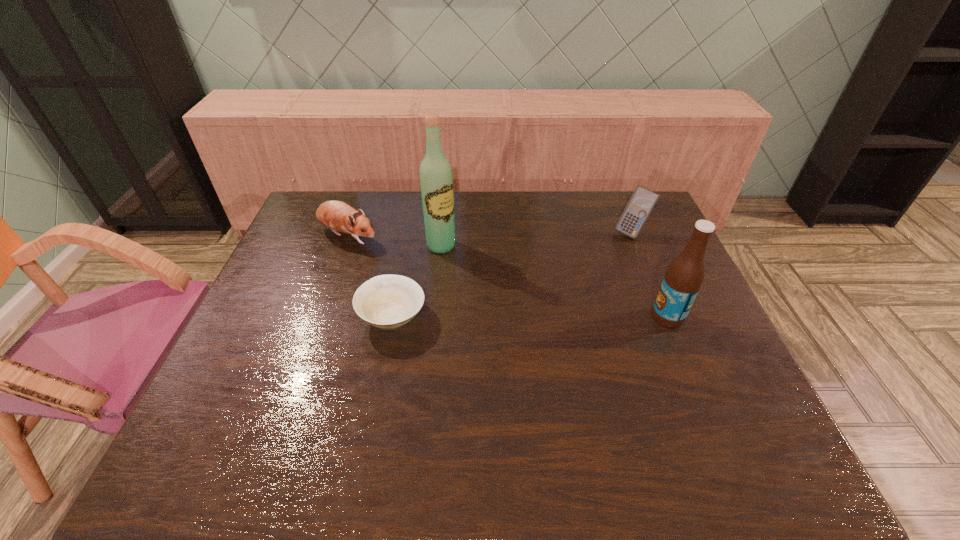
The height and width of the screenshot is (540, 960). I want to click on free space located 0.300m on the front-facing side of the third tallest object, so click(x=580, y=293).

At what (x,y) coordinates should I click in order to perform the action: click on vacant space located 0.260m on the front-facing side of the third tallest object. Please return your answer as a coordinate pair (x, y). This screenshot has width=960, height=540. Looking at the image, I should click on (586, 285).

Locate an element on the screen. Image resolution: width=960 pixels, height=540 pixels. vacant space located on the front-facing side of the third tallest object is located at coordinates (565, 310).

The width and height of the screenshot is (960, 540). I want to click on vacant region located 0.070m at the face of the fourth tallest object, so [x=387, y=253].

At what (x,y) coordinates should I click in order to perform the action: click on free region located 0.080m at the face of the fourth tallest object. Please return your answer as a coordinate pair (x, y). The width and height of the screenshot is (960, 540). Looking at the image, I should click on (390, 255).

In order to click on vacant area situated at the face of the fourth tallest object in this screenshot , I will do `click(421, 272)`.

Identify the location of calculator positioned at the far edge. This screenshot has width=960, height=540. (642, 202).

At what (x,y) coordinates should I click in order to perform the action: click on hamster located at the far edge. Please return your answer as a coordinate pair (x, y). This screenshot has width=960, height=540. Looking at the image, I should click on (338, 216).

Find the location of a particular element. This screenshot has height=540, width=960. object that is at the left edge is located at coordinates (338, 216).

At what (x,y) coordinates should I click in order to perform the action: click on beer bottle situated at the right edge. Please return your answer as a coordinate pair (x, y). This screenshot has height=540, width=960. Looking at the image, I should click on (684, 276).